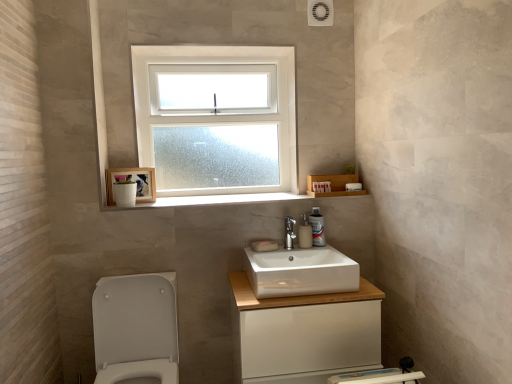
Question: Does white glossy sink at center lie in front of satin nickel faucet at center?

Choices:
 (A) yes
 (B) no

Answer: (A)

Question: Can you confirm if white glossy sink at center is taller than satin nickel faucet at center?

Choices:
 (A) yes
 (B) no

Answer: (A)

Question: Could you tell me if white glossy sink at center is facing satin nickel faucet at center?

Choices:
 (A) yes
 (B) no

Answer: (B)

Question: Does white glossy sink at center have a lesser height compared to satin nickel faucet at center?

Choices:
 (A) yes
 (B) no

Answer: (B)

Question: From a real-world perspective, is white glossy sink at center positioned under satin nickel faucet at center based on gravity?

Choices:
 (A) no
 (B) yes

Answer: (B)

Question: Is white glossy sink at center oriented away from satin nickel faucet at center?

Choices:
 (A) no
 (B) yes

Answer: (B)

Question: Considering the relative positions of clear glass window at upper center and white matte soap at center, the 1th soap from the front, in the image provided, is clear glass window at upper center to the left of white matte soap at center, the 1th soap from the front, from the viewer's perspective?

Choices:
 (A) no
 (B) yes

Answer: (B)

Question: Does clear glass window at upper center have a greater height compared to white matte soap at center, acting as the 2th soap starting from the back?

Choices:
 (A) yes
 (B) no

Answer: (A)

Question: Is clear glass window at upper center to the right of white matte soap at center, the 1th soap from the front, from the viewer's perspective?

Choices:
 (A) no
 (B) yes

Answer: (A)

Question: Is clear glass window at upper center aimed at white matte soap at center, the 1th soap from the front?

Choices:
 (A) no
 (B) yes

Answer: (B)

Question: Is clear glass window at upper center bigger than white matte soap at center, the 1th soap from the front?

Choices:
 (A) no
 (B) yes

Answer: (B)

Question: Considering the relative sizes of clear glass window at upper center and white matte soap at center, the 1th soap from the front, in the image provided, is clear glass window at upper center shorter than white matte soap at center, the 1th soap from the front,?

Choices:
 (A) yes
 (B) no

Answer: (B)

Question: Is white matte soap at center, the first soap in the back-to-front sequence, located within white matte soap at center, acting as the 2th soap starting from the back?

Choices:
 (A) no
 (B) yes

Answer: (B)